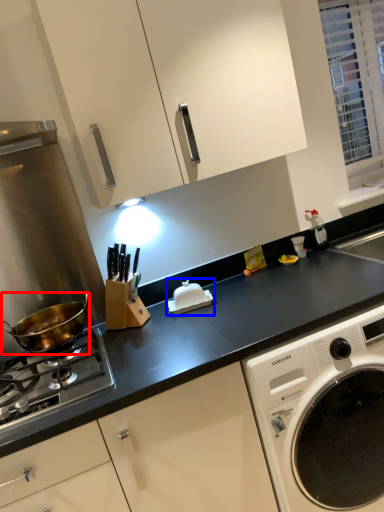
Question: Which object appears closest to the camera in this image, wok (highlighted by a red box) or appliance (highlighted by a blue box)?

Choices:
 (A) wok
 (B) appliance

Answer: (A)